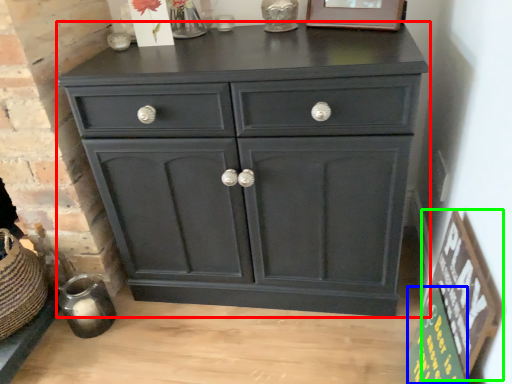
Question: Which object is positioned closest to chest of drawers (highlighted by a red box)? Select from bulletin board (highlighted by a blue box) and bulletin board (highlighted by a green box).

Choices:
 (A) bulletin board
 (B) bulletin board

Answer: (B)